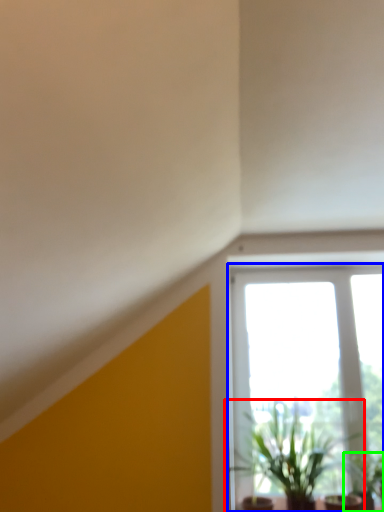
Question: Based on their relative distances, which object is farther from houseplant (highlighted by a red box)? Choose from window (highlighted by a blue box) and houseplant (highlighted by a green box).

Choices:
 (A) window
 (B) houseplant

Answer: (B)